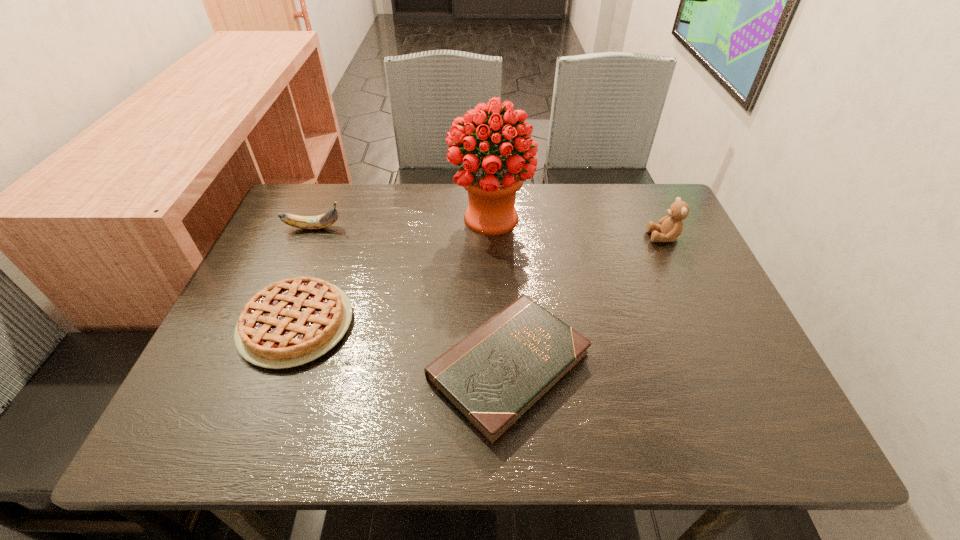
This screenshot has width=960, height=540. Identify the location of the tallest object. (492, 178).

The height and width of the screenshot is (540, 960). Identify the location of the rightmost object. (670, 227).

Identify the location of the second tallest object. (670, 227).

Image resolution: width=960 pixels, height=540 pixels. What are the coordinates of `the third tallest object` in the screenshot? It's located at (321, 221).

Locate an element on the screen. This screenshot has height=540, width=960. pie is located at coordinates click(x=292, y=322).

You are a GUI agent. You are given a task and a screenshot of the screen. Output one action in this format:
    pyautogui.click(x=<x>, y=<y>)
    Task: Click on the Bible
    The width and height of the screenshot is (960, 540).
    Given the screenshot: What is the action you would take?
    pyautogui.click(x=493, y=377)

Identify the location of vacant region located 0.400m on the left of the bouquet. (307, 219).

The height and width of the screenshot is (540, 960). I want to click on free location located on the face of the teddy bear, so [518, 237].

You are a GUI agent. You are given a task and a screenshot of the screen. Output one action in this format:
    pyautogui.click(x=<x>, y=<y>)
    Task: Click on the vacant space located 0.240m on the face of the teddy bear
    
    Given the screenshot: What is the action you would take?
    click(x=559, y=237)

Locate an element on the screen. This screenshot has width=960, height=540. vacant space located 0.270m on the face of the teddy bear is located at coordinates (548, 237).